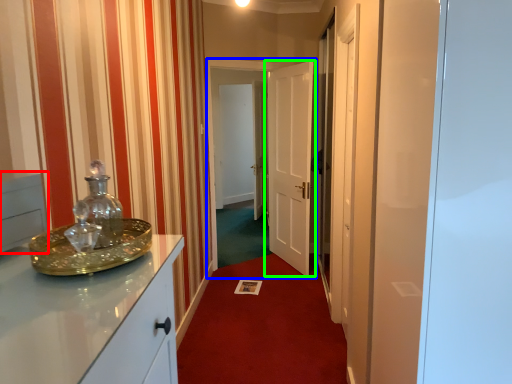
Question: Based on their relative distances, which object is farther from cabinetry (highlighted by a red box)? Choose from glass door (highlighted by a blue box) and door (highlighted by a green box).

Choices:
 (A) glass door
 (B) door

Answer: (B)